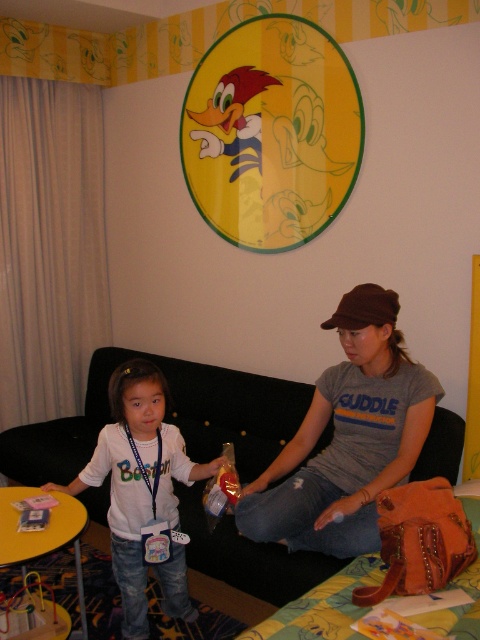
You are a photographer taking a picture of the white matte shirt at center and the brown fabric baseball cap at center. Which object should you focus on first if you want to capture both clearly in the frame?

The white matte shirt at center is taller than the brown fabric baseball cap at center, so you should focus on the white matte shirt at center first to ensure both are in clear focus.